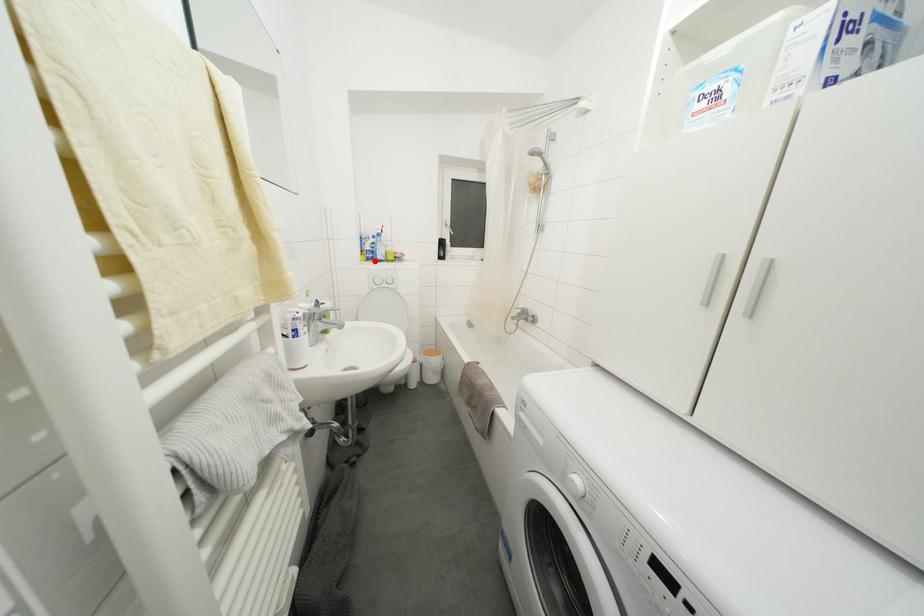
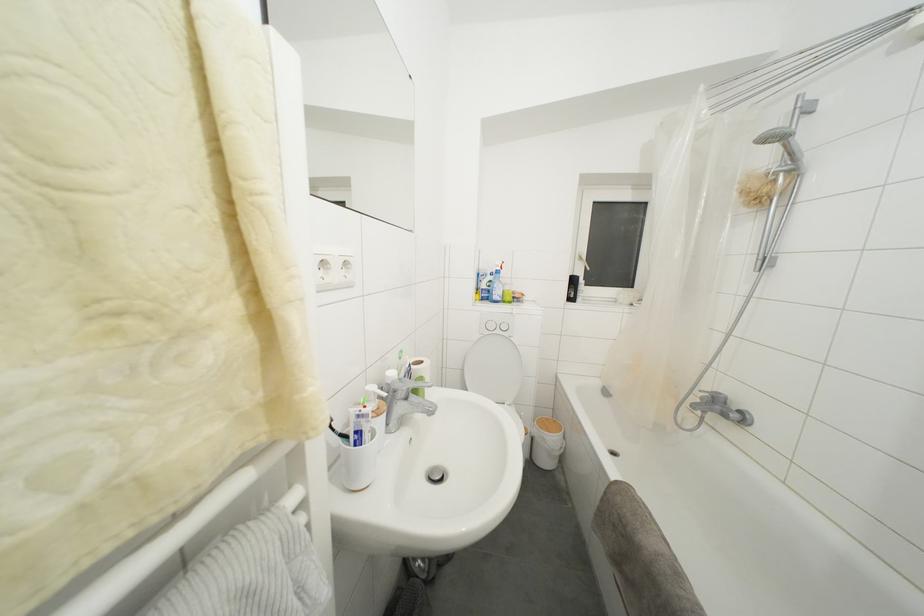
Question: I am providing you with two images of the same scene from different viewpoints. A red point is marked on the first image. At the location where the point appears in image 1, is it still visible in image 2?

Choices:
 (A) Yes
 (B) No

Answer: (A)